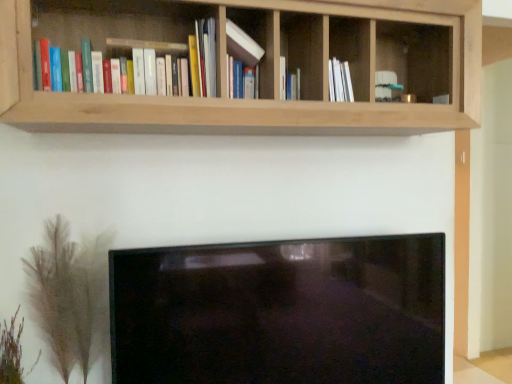
Question: Looking at their shapes, would you say green feathery plant at lower left, which ranks as the first plant in left-to-right order, is wider or thinner than matte white book at center, which is the first book from right to left?

Choices:
 (A) wide
 (B) thin

Answer: (A)

Question: Considering the positions of green feathery plant at lower left, which ranks as the first plant in left-to-right order, and matte white book at center, which ranks as the 2th book in left-to-right order, in the image, is green feathery plant at lower left, which ranks as the first plant in left-to-right order, taller or shorter than matte white book at center, which ranks as the 2th book in left-to-right order,?

Choices:
 (A) short
 (B) tall

Answer: (A)

Question: Which object is the farthest from the natural wood shelf at upper center?

Choices:
 (A) green feathery plant at lower left, which appears as the 2th plant when viewed from the right
 (B) green fuzzy plant at lower left, acting as the first plant starting from the right
 (C) matte white book at center, which is the first book from right to left
 (D) hardcover books at upper left, which is the second book in right-to-left order

Answer: (A)

Question: Estimate the real-world distances between objects in this image. Which object is farther from the green fuzzy plant at lower left, the second plant in the left-to-right sequence?

Choices:
 (A) matte white book at center, which ranks as the 2th book in left-to-right order
 (B) green feathery plant at lower left, which ranks as the first plant in left-to-right order
 (C) natural wood shelf at upper center
 (D) hardcover books at upper left, which is the second book in right-to-left order

Answer: (A)